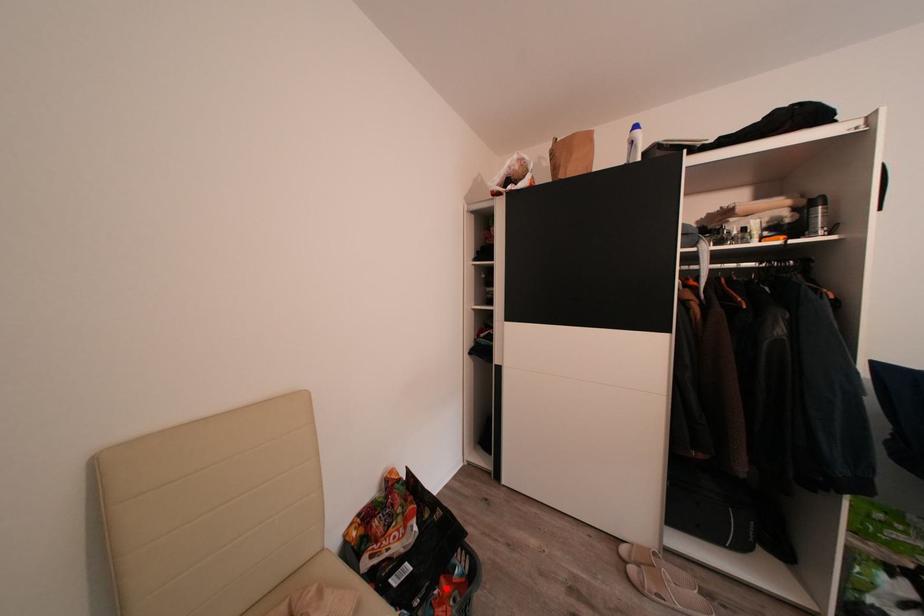
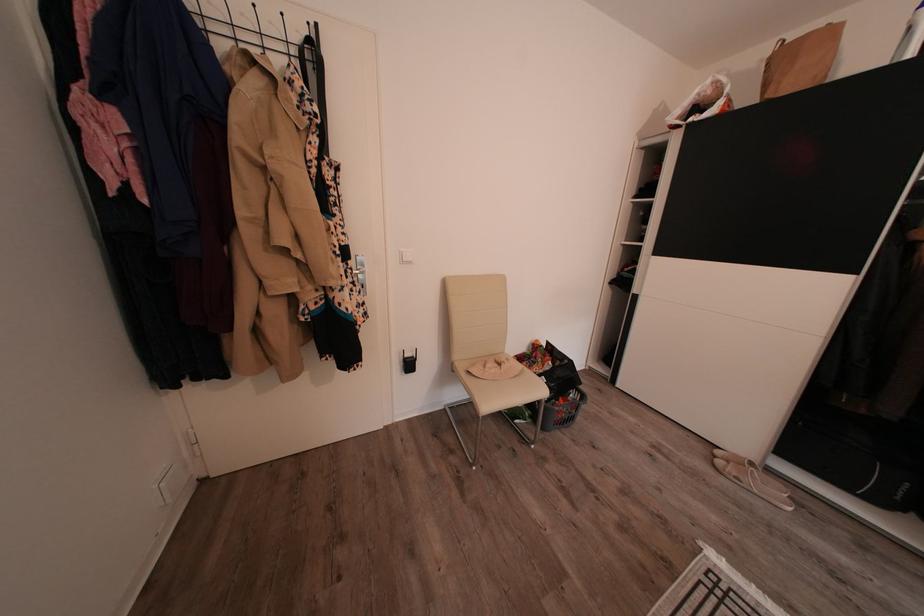
Question: I am providing you with two images of the same scene from different viewpoints. Given a red point in image1, look at the same physical point in image2. Is it:

Choices:
 (A) Closer to the viewpoint
 (B) Farther from the viewpoint

Answer: (B)